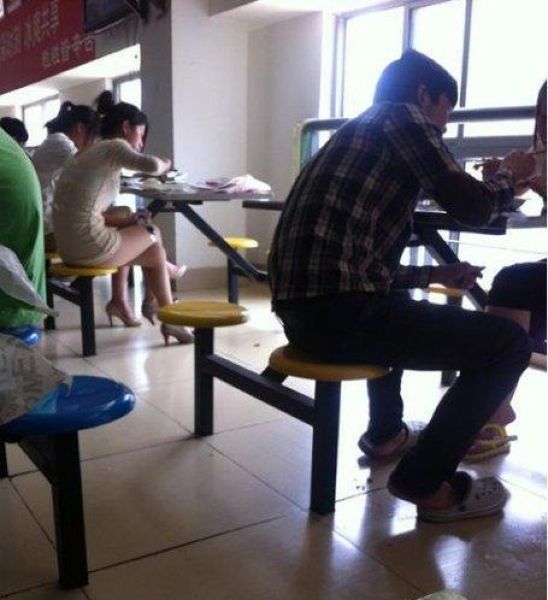
Where is `stool`? This screenshot has width=548, height=600. stool is located at coordinates (97, 409).